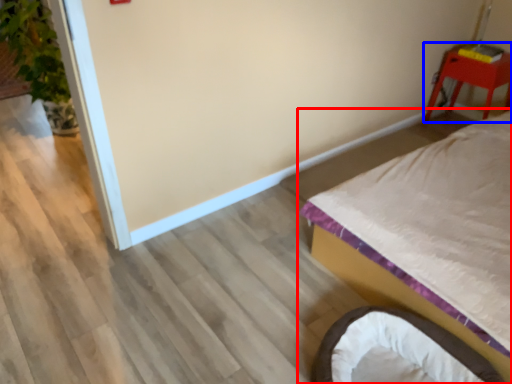
Question: Among these objects, which one is nearest to the camera, bed (highlighted by a red box) or furniture (highlighted by a blue box)?

Choices:
 (A) bed
 (B) furniture

Answer: (A)